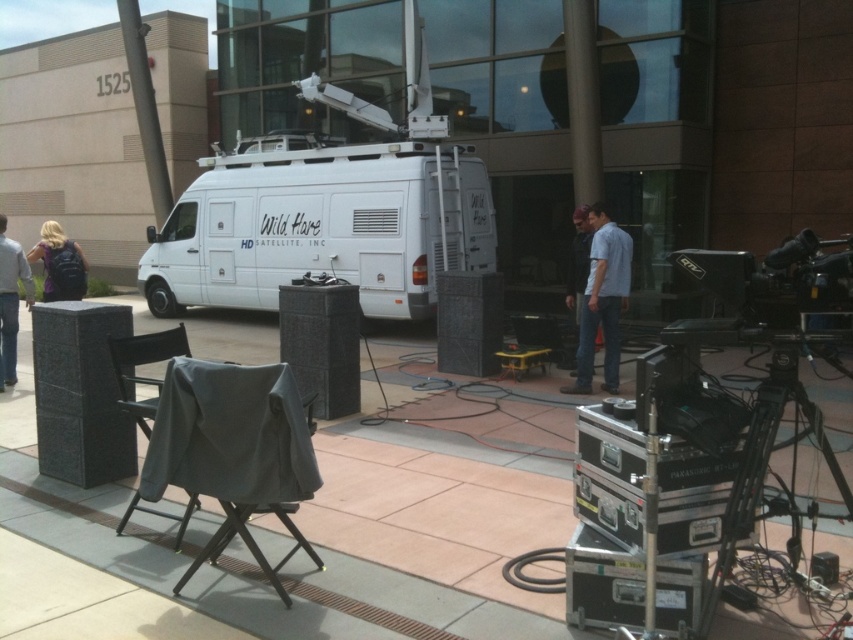
Is blue denim jeans at center positioned at the back of denim jacket at left?

No, it is in front of denim jacket at left.

Is blue denim jeans at center taller than denim jacket at left?

Yes, blue denim jeans at center is taller than denim jacket at left.

Who is more distant from viewer, (596,296) or (10,348)?

Positioned behind is point (10,348).

This screenshot has height=640, width=853. I want to click on blue denim jeans at center, so click(602, 301).

Which is behind, point (625, 292) or point (138, 381)?

The point (625, 292) is behind.

Is blue denim jeans at center positioned before gray fabric chair at lower left?

That is False.

Between point (606, 246) and point (119, 374), which one is positioned in front?

Point (119, 374) is in front.

Find the location of a particular element. The image size is (853, 640). blue denim jeans at center is located at coordinates (602, 301).

What do you see at coordinates (10, 301) in the screenshot? I see `denim jacket at left` at bounding box center [10, 301].

Is denim jacket at left in front of purple matte backpack at left?

No.

Which is behind, point (9, 355) or point (44, 228)?

Positioned behind is point (44, 228).

The width and height of the screenshot is (853, 640). I want to click on denim jacket at left, so click(10, 301).